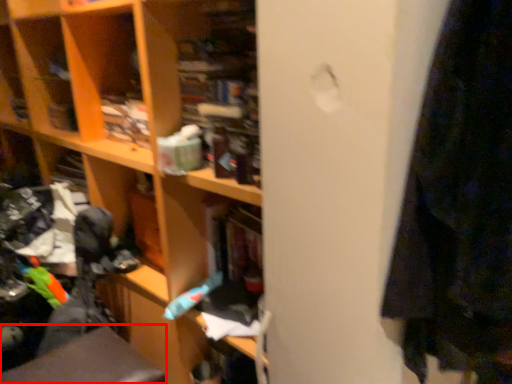
Question: From the image's perspective, what is the correct spatial relationship of swivel chair (annotated by the red box) in relation to toy?

Choices:
 (A) above
 (B) below

Answer: (B)